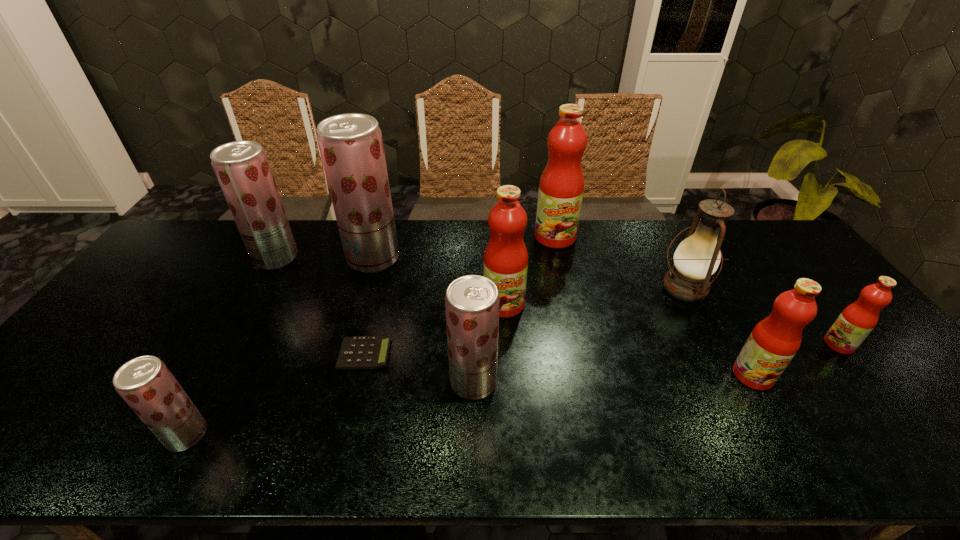
Locate an element on the screen. This screenshot has width=960, height=540. object that is at the right edge is located at coordinates (x=854, y=324).

What are the coordinates of `vacant space at the far edge of the desktop` in the screenshot? It's located at (314, 237).

In the image, there is a desktop. Identify the location of vacant space at the near edge. (654, 445).

In the image, there is a desktop. Identify the location of free region at the left edge. (142, 279).

In the image, there is a desktop. Find the location of `free space at the right edge`. free space at the right edge is located at coordinates (826, 315).

Where is `blank space at the far left corner`? blank space at the far left corner is located at coordinates (x=183, y=259).

Where is `free space at the near left corner of the desktop`? The height and width of the screenshot is (540, 960). free space at the near left corner of the desktop is located at coordinates (36, 440).

In the image, there is a desktop. Where is `free space at the far right corner`? This screenshot has height=540, width=960. free space at the far right corner is located at coordinates (769, 254).

Where is `vacant area that lies between the nearest fruit juice and the third smallest strawberry fruit juice`? This screenshot has height=540, width=960. vacant area that lies between the nearest fruit juice and the third smallest strawberry fruit juice is located at coordinates (231, 346).

Where is `free space that is in between the second strawberry fruit juice from right to left and the second fruit juice from right to left`? This screenshot has width=960, height=540. free space that is in between the second strawberry fruit juice from right to left and the second fruit juice from right to left is located at coordinates (564, 316).